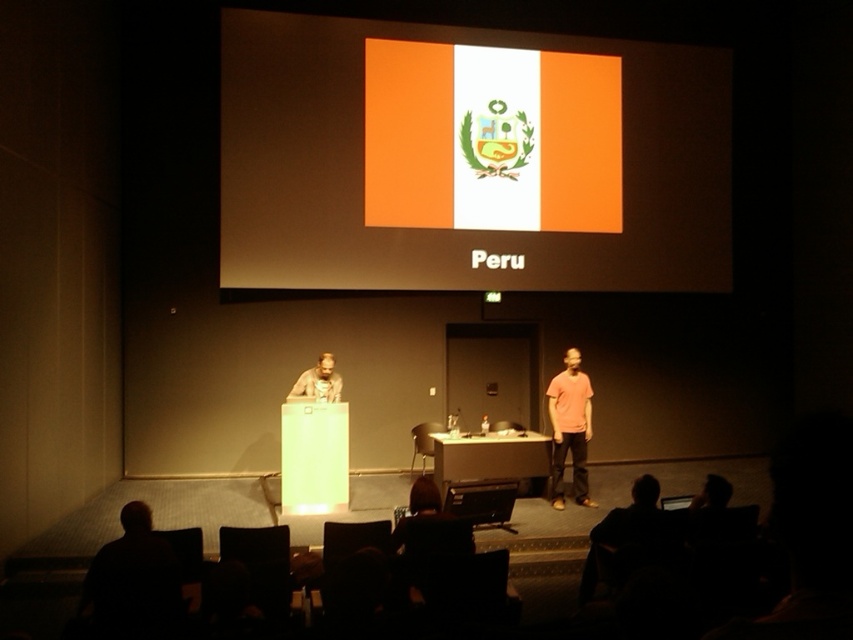
You are standing in the conference hall and want to know how far you are from the point marked as point [602,68]. Can you determine the distance?

The point [602,68] is 32.60 feet away from the viewer.